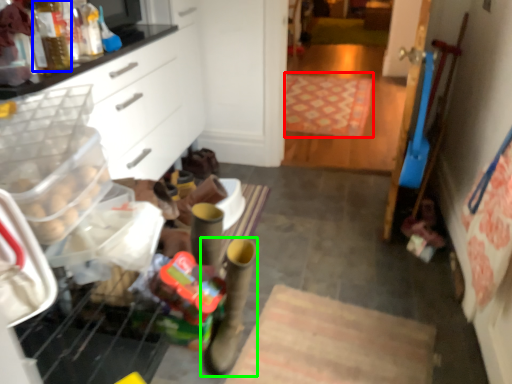
Question: Which is farther away from mat (highlighted by a red box)? bottle (highlighted by a blue box) or footwear (highlighted by a green box)?

Choices:
 (A) bottle
 (B) footwear

Answer: (A)